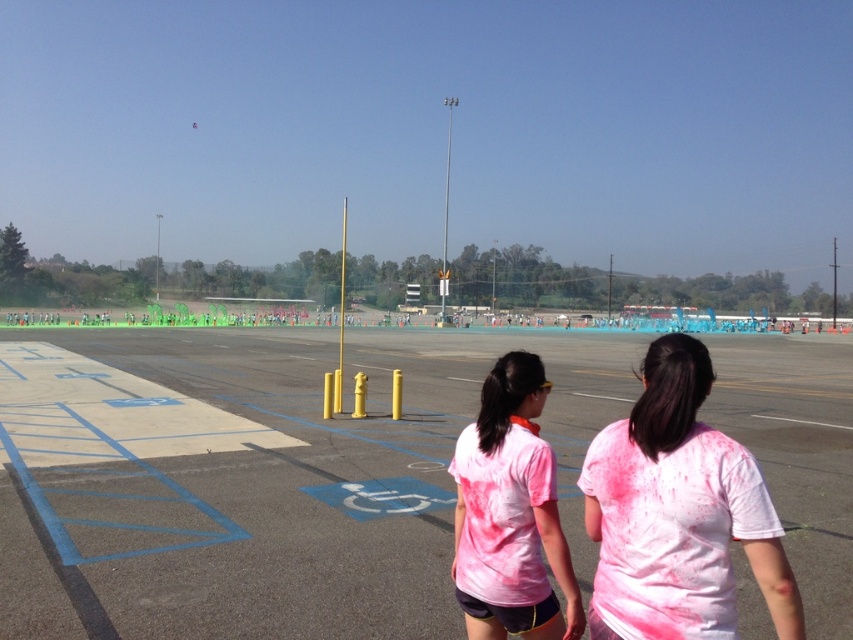
Question: Which point is closer to the camera?

Choices:
 (A) tap(732, 589)
 (B) tap(831, 541)

Answer: (A)

Question: Does white cotton t-shirt at center appear on the right side of pink tie-dye t-shirt at center?

Choices:
 (A) no
 (B) yes

Answer: (B)

Question: Which object is positioned closest to the white cotton t-shirt at center?

Choices:
 (A) white asphalt tarmac at center
 (B) pink tie-dye t-shirt at center

Answer: (B)

Question: Is white cotton t-shirt at center closer to the viewer compared to pink tie-dye t-shirt at center?

Choices:
 (A) no
 (B) yes

Answer: (B)

Question: Can you confirm if white asphalt tarmac at center is smaller than white cotton t-shirt at center?

Choices:
 (A) yes
 (B) no

Answer: (B)

Question: Which object is closer to the camera taking this photo?

Choices:
 (A) white asphalt tarmac at center
 (B) pink tie-dye t-shirt at center

Answer: (B)